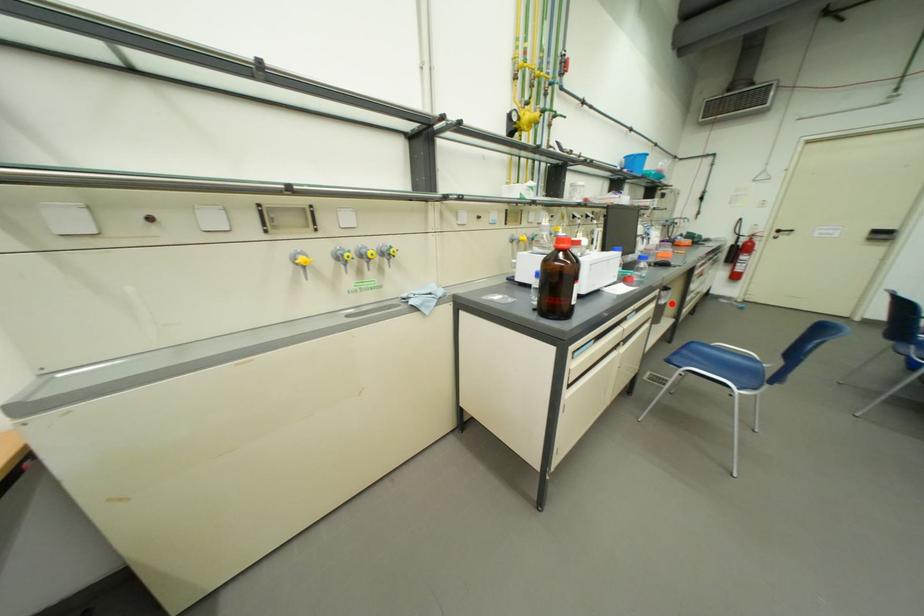
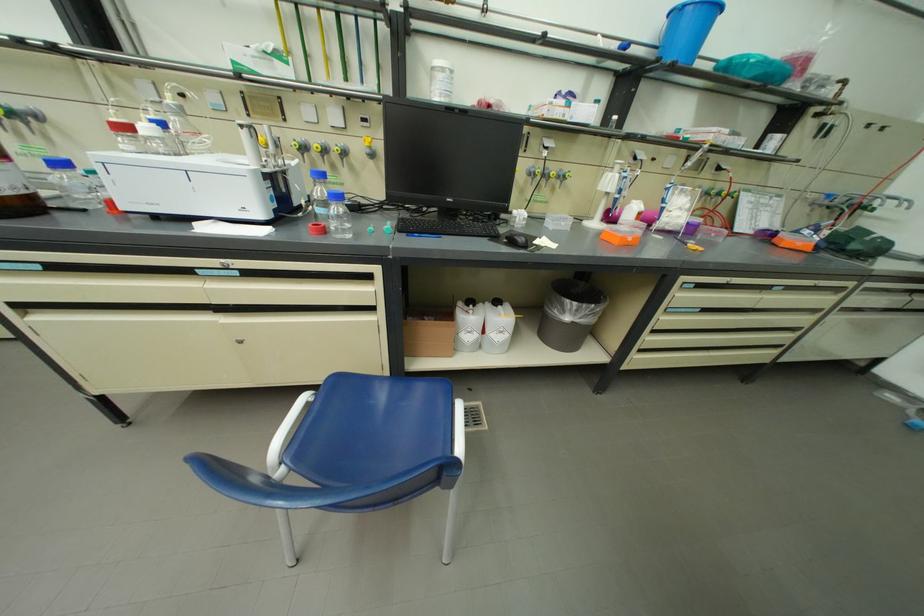
In the second image, find the point that corresponds to the highlighted location in the first image.

(577, 320)